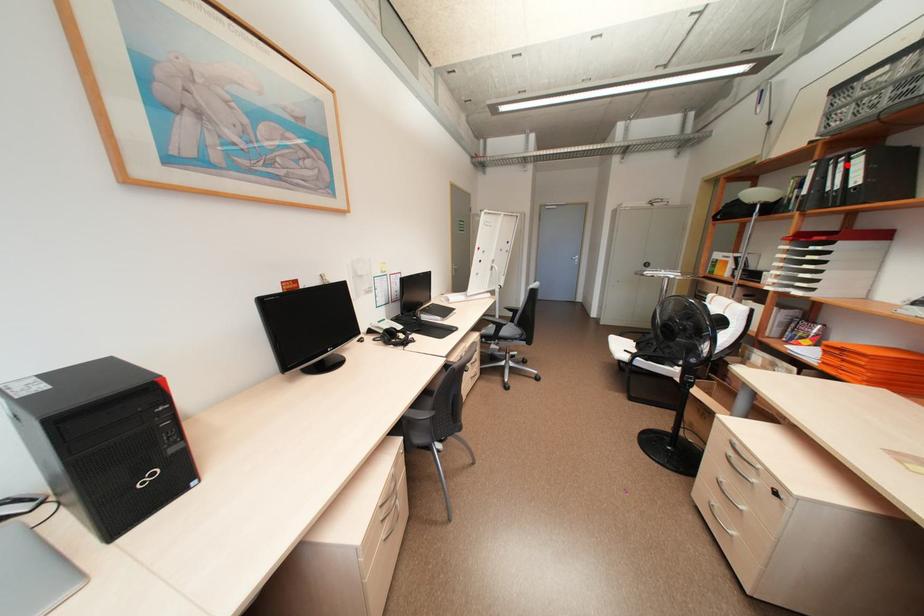
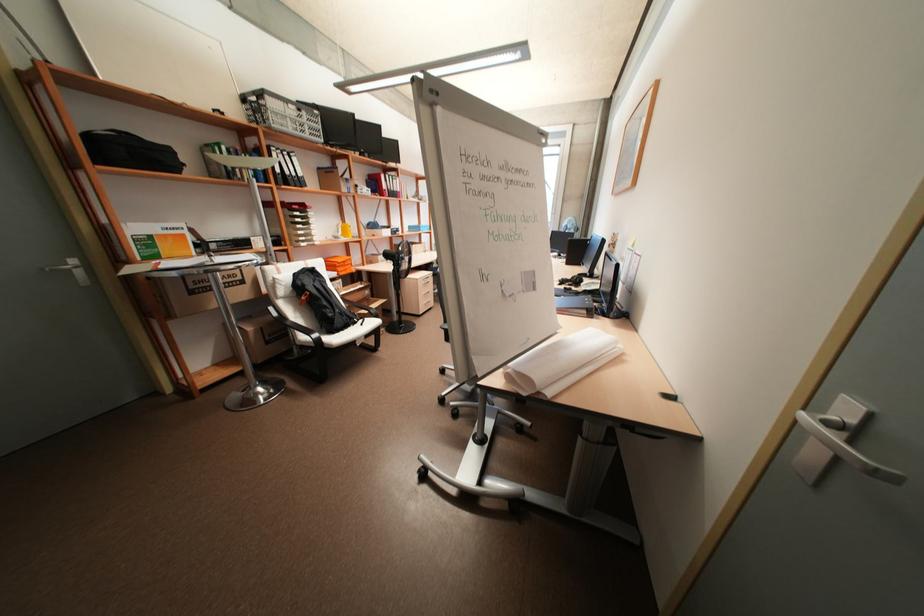
In the second image, find the point that corresponds to the highlighted location in the first image.

(293, 158)